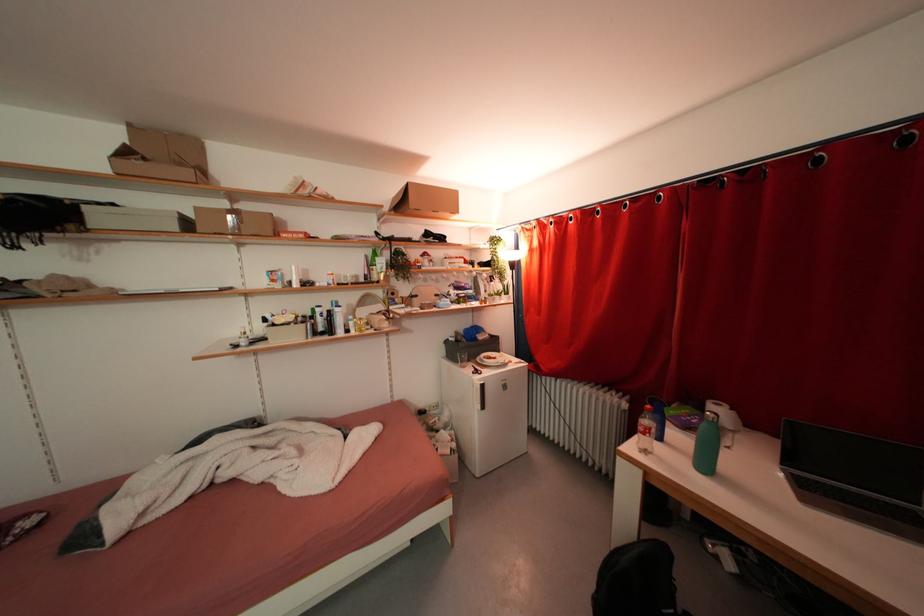
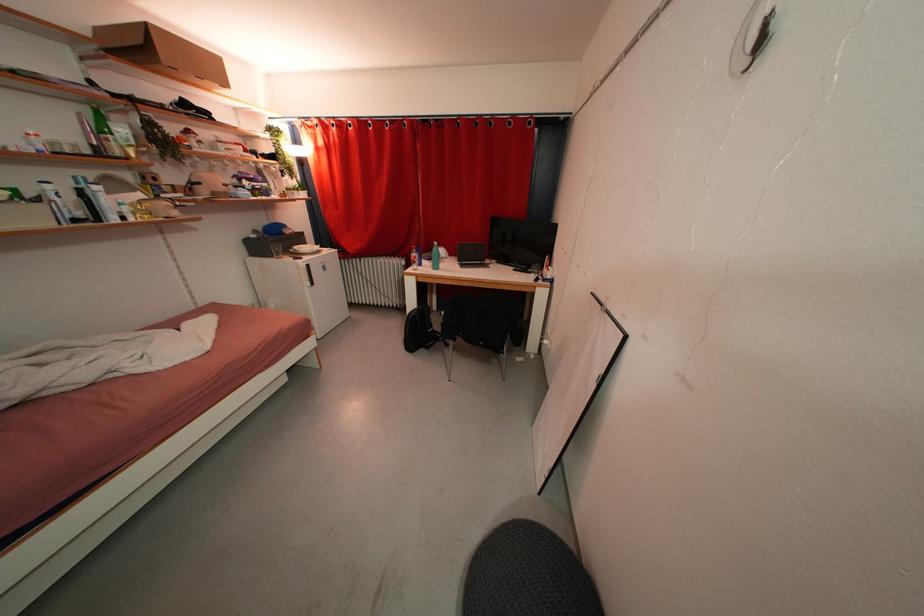
Locate, in the second image, the point that corresponds to point (756, 428) in the first image.

(456, 257)